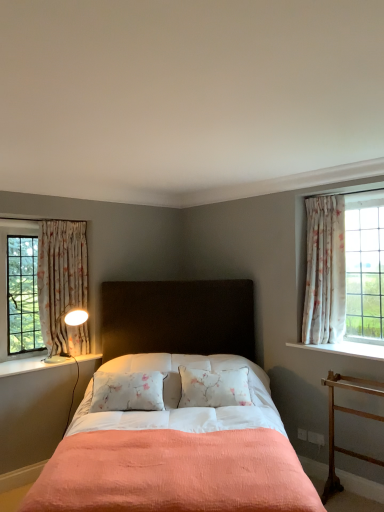
Question: From the image's perspective, is matte black headboard at center on floral fabric curtain at right, the second curtain viewed from the left?

Choices:
 (A) no
 (B) yes

Answer: (A)

Question: Considering the relative sizes of matte black headboard at center and floral fabric curtain at right, the second curtain viewed from the left, in the image provided, is matte black headboard at center wider than floral fabric curtain at right, the second curtain viewed from the left,?

Choices:
 (A) yes
 (B) no

Answer: (A)

Question: Is floral fabric curtain at right, marked as the first curtain in a right-to-left arrangement, completely or partially inside matte black headboard at center?

Choices:
 (A) yes
 (B) no

Answer: (B)

Question: From a real-world perspective, is matte black headboard at center on top of floral fabric curtain at right, the second curtain viewed from the left?

Choices:
 (A) yes
 (B) no

Answer: (B)

Question: Does matte black headboard at center have a lesser width compared to floral fabric curtain at right, marked as the first curtain in a right-to-left arrangement?

Choices:
 (A) yes
 (B) no

Answer: (B)

Question: Considering the relative positions of matte black headboard at center and floral fabric curtain at right, the second curtain viewed from the left, in the image provided, is matte black headboard at center to the right of floral fabric curtain at right, the second curtain viewed from the left, from the viewer's perspective?

Choices:
 (A) yes
 (B) no

Answer: (B)

Question: Is matte white table lamp at left oriented away from floral fabric curtain at right, the second curtain viewed from the left?

Choices:
 (A) no
 (B) yes

Answer: (A)

Question: From the image's perspective, is matte white table lamp at left under floral fabric curtain at right, the second curtain viewed from the left?

Choices:
 (A) yes
 (B) no

Answer: (A)

Question: Considering the relative positions of matte white table lamp at left and floral fabric curtain at right, the second curtain viewed from the left, in the image provided, is matte white table lamp at left to the right of floral fabric curtain at right, the second curtain viewed from the left, from the viewer's perspective?

Choices:
 (A) no
 (B) yes

Answer: (A)

Question: Is matte white table lamp at left taller than floral fabric curtain at right, marked as the first curtain in a right-to-left arrangement?

Choices:
 (A) yes
 (B) no

Answer: (B)

Question: Could you tell me if matte white table lamp at left is turned towards floral fabric curtain at right, the second curtain viewed from the left?

Choices:
 (A) no
 (B) yes

Answer: (A)

Question: Can you confirm if matte white table lamp at left is wider than floral fabric curtain at right, marked as the first curtain in a right-to-left arrangement?

Choices:
 (A) yes
 (B) no

Answer: (A)

Question: From the image's perspective, does wooden at right appear higher than floral fabric curtain at left, positioned as the 2th curtain in right-to-left order?

Choices:
 (A) no
 (B) yes

Answer: (A)